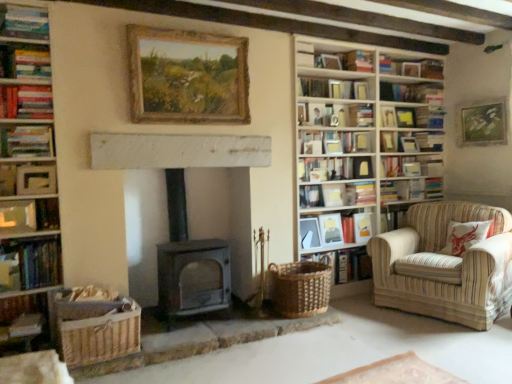
Question: Is matte wooden picture frame at center-right, placed as the second picture frame when sorted from right to left, bigger than woven basket at lower right, marked as the first book in a bottom-to-top arrangement?

Choices:
 (A) yes
 (B) no

Answer: (B)

Question: Is matte wooden picture frame at center-right, marked as the third picture frame in a bottom-to-top arrangement, aimed at woven basket at lower right, marked as the first book in a bottom-to-top arrangement?

Choices:
 (A) no
 (B) yes

Answer: (A)

Question: Does matte wooden picture frame at center-right, placed as the second picture frame when sorted from right to left, have a greater width compared to woven basket at lower right, marked as the first book in a bottom-to-top arrangement?

Choices:
 (A) yes
 (B) no

Answer: (B)

Question: Would you say matte wooden picture frame at center-right, the 3th picture frame when ordered from top to bottom, contains woven basket at lower right, marked as the first book in a bottom-to-top arrangement?

Choices:
 (A) yes
 (B) no

Answer: (B)

Question: Is the depth of matte wooden picture frame at center-right, marked as the third picture frame in a bottom-to-top arrangement, less than that of woven basket at lower right, the thirteenth book viewed from the top?

Choices:
 (A) yes
 (B) no

Answer: (B)

Question: Does matte wooden picture frame at center-right, which is counted as the fifth picture frame, starting from the front, have a lesser height compared to woven basket at lower right, marked as the first book in a bottom-to-top arrangement?

Choices:
 (A) yes
 (B) no

Answer: (A)

Question: Is dark gray matte wood burning stove at center not near hardcover books at left, which is counted as the eleventh book, starting from the bottom?

Choices:
 (A) yes
 (B) no

Answer: (A)

Question: Is the position of dark gray matte wood burning stove at center less distant than that of hardcover books at left, which appears as the 3th book when viewed from the top?

Choices:
 (A) no
 (B) yes

Answer: (A)

Question: Does dark gray matte wood burning stove at center have a lesser width compared to hardcover books at left, which appears as the 3th book when viewed from the top?

Choices:
 (A) no
 (B) yes

Answer: (A)

Question: Does dark gray matte wood burning stove at center appear on the right side of hardcover books at left, which appears as the 3th book when viewed from the top?

Choices:
 (A) no
 (B) yes

Answer: (B)

Question: From a real-world perspective, does dark gray matte wood burning stove at center stand above hardcover books at left, which is counted as the eleventh book, starting from the bottom?

Choices:
 (A) yes
 (B) no

Answer: (B)

Question: Is dark gray matte wood burning stove at center positioned behind hardcover books at left, which appears as the 3th book when viewed from the top?

Choices:
 (A) yes
 (B) no

Answer: (A)

Question: Is hardcover books at left, which is counted as the eleventh book, starting from the bottom, placed right next to matte white frame at upper left, which is counted as the 6th book, starting from the bottom?

Choices:
 (A) yes
 (B) no

Answer: (B)